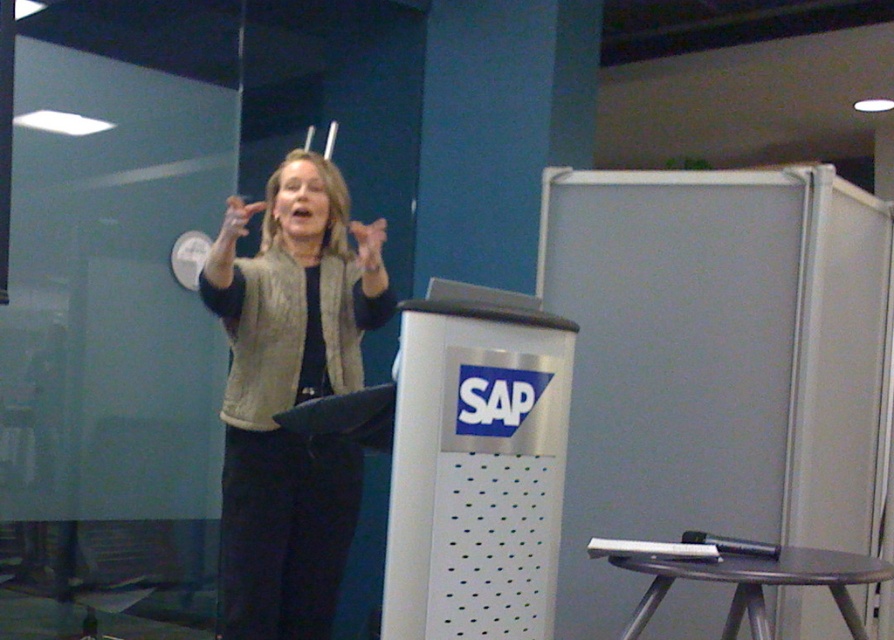
You are an event planner setting up a presentation area. You notice the metallic stool at lower right and the matte beige hand at upper center. Is the stool placed under the hand?

Yes, the metallic stool at lower right is positioned under the matte beige hand at upper center, so the stool is indeed placed under the hand.

You are an event photographer capturing the speaker at the SAP podium. You notice the light beige vest at center and the matte beige hand at upper center in your frame. Which object is positioned lower in the image?

The light beige vest at center is positioned below the matte beige hand at upper center, so the light beige vest at center is lower in the image.